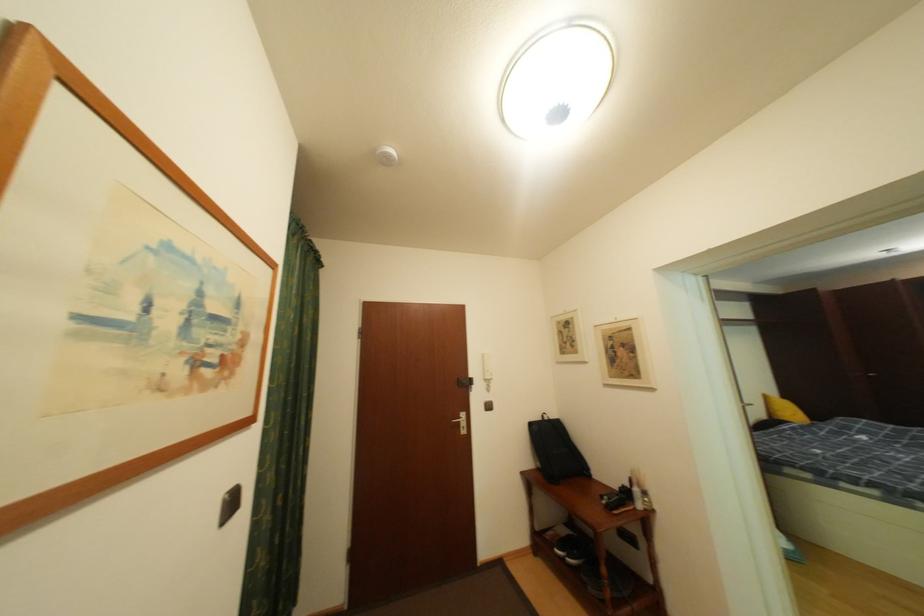
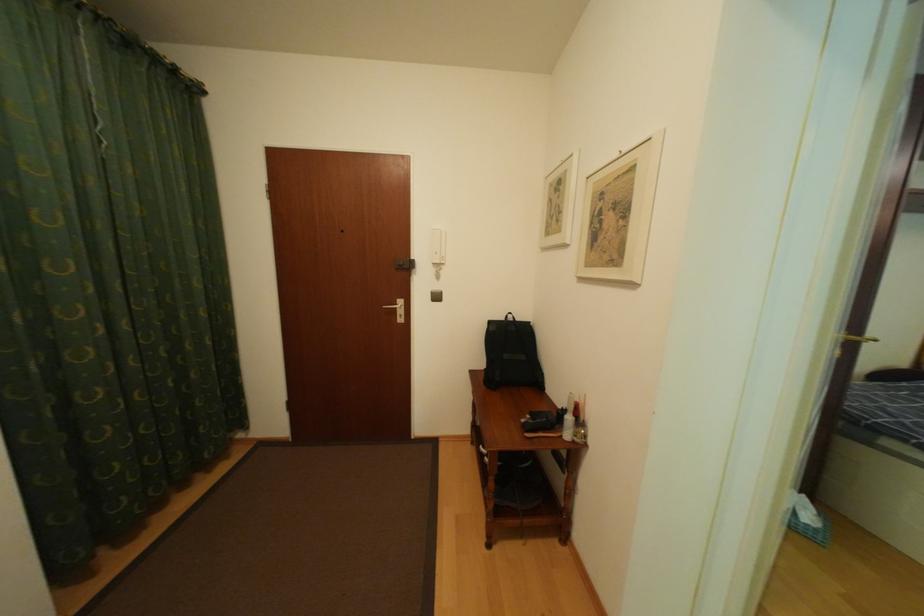
Locate, in the second image, the point that corresponds to pixel 627 487 in the first image.

(572, 408)